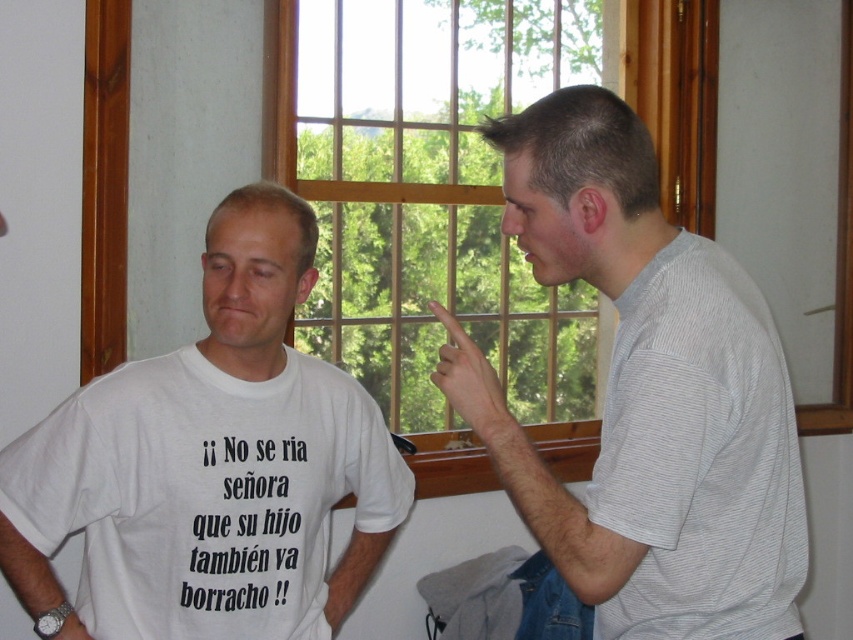
Question: Does white cotton t-shirt at left appear on the right side of gray striped t-shirt at right?

Choices:
 (A) no
 (B) yes

Answer: (A)

Question: Which point is farther to the camera?

Choices:
 (A) (693, 557)
 (B) (141, 600)
 (C) (576, 513)

Answer: (B)

Question: Can you confirm if gray striped shirt at right is positioned to the right of wooden frame at upper center?

Choices:
 (A) yes
 (B) no

Answer: (A)

Question: Can you confirm if white cotton t-shirt at left is bigger than gray striped t-shirt at right?

Choices:
 (A) no
 (B) yes

Answer: (B)

Question: Estimate the real-world distances between objects in this image. Which object is farther from the white cotton t-shirt at left?

Choices:
 (A) gray striped shirt at right
 (B) wooden frame at upper center

Answer: (B)

Question: Which object is closer to the camera taking this photo?

Choices:
 (A) gray striped t-shirt at right
 (B) gray striped shirt at right

Answer: (A)